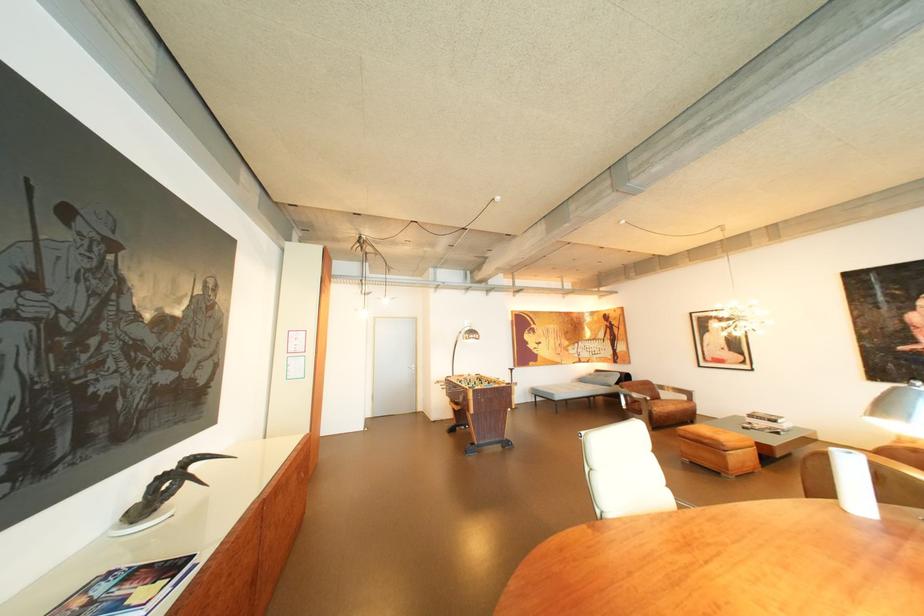
Which object does [127,589] point to?

It refers to a colorful magazine.